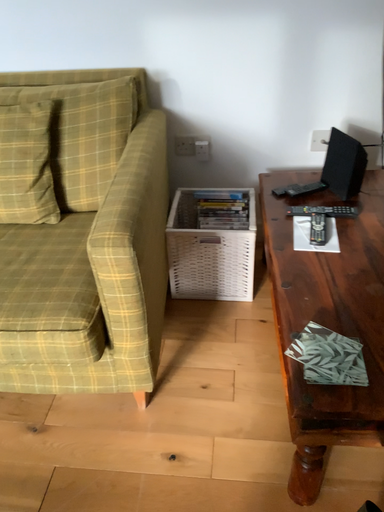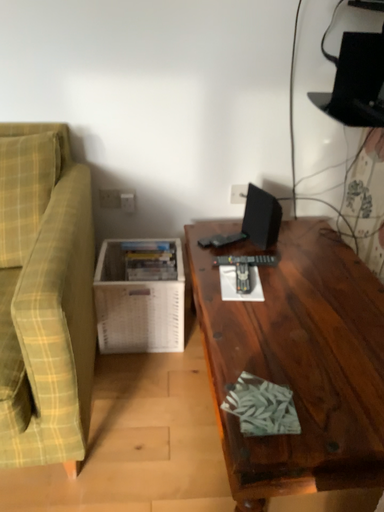
Question: How did the camera likely rotate when shooting the video?

Choices:
 (A) rotated right
 (B) rotated left

Answer: (A)